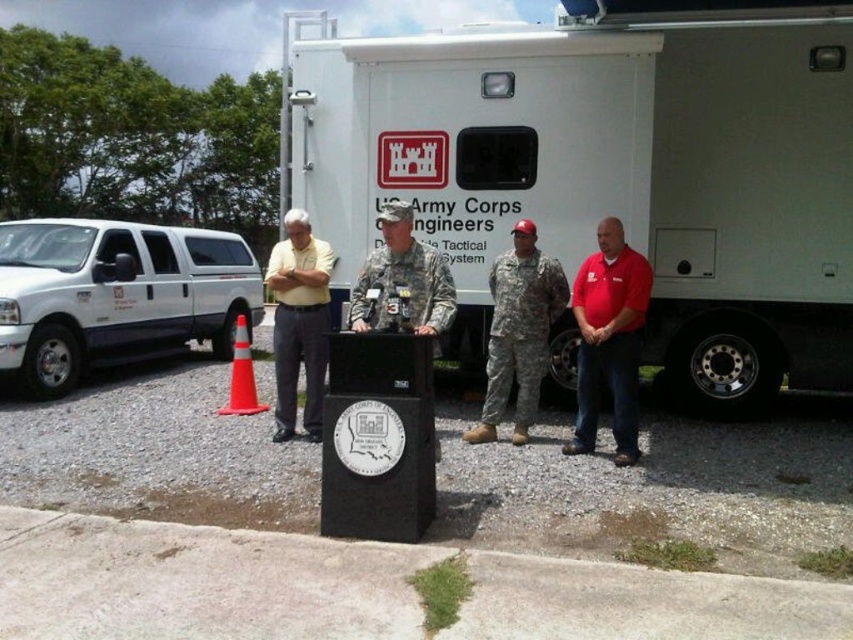
Question: Which point is closer to the camera?

Choices:
 (A) (277, 429)
 (B) (387, 237)
 (C) (531, 304)
 (D) (204, 273)

Answer: (B)

Question: Can you confirm if white matte truck at center is wider than orange reflective cone at lower left?

Choices:
 (A) no
 (B) yes

Answer: (B)

Question: Which object appears farthest from the camera in this image?

Choices:
 (A) yellow shirt at left
 (B) camouflage fabric soldier at center

Answer: (A)

Question: Which of the following is the closest to the observer?

Choices:
 (A) white matte van at left
 (B) white matte truck at center
 (C) red cotton shirt at right
 (D) camouflage uniform at center

Answer: (D)

Question: Observing the image, what is the correct spatial positioning of white matte truck at center in reference to red cotton shirt at right?

Choices:
 (A) right
 (B) left

Answer: (A)

Question: Observing the image, what is the correct spatial positioning of camouflage uniform at center in reference to orange reflective cone at lower left?

Choices:
 (A) below
 (B) above

Answer: (B)